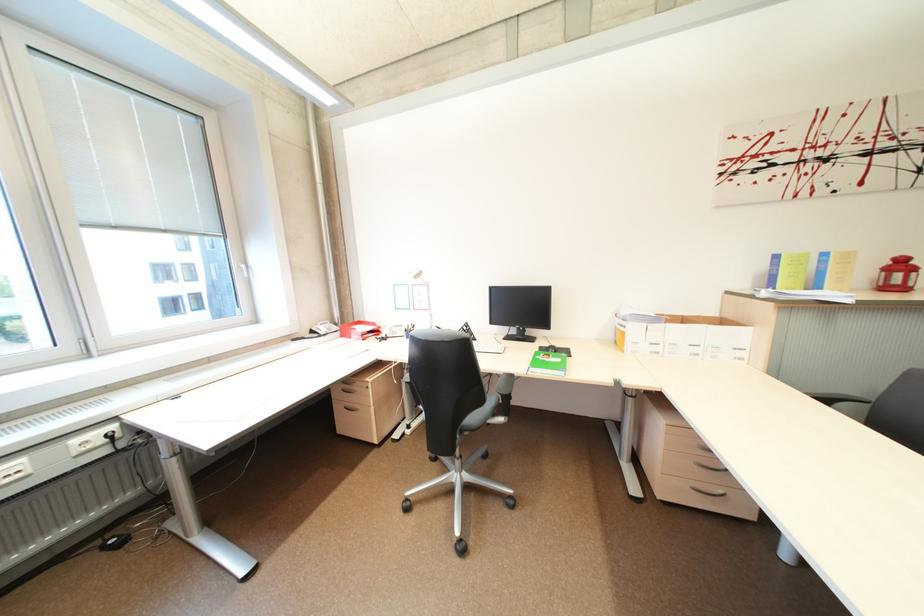
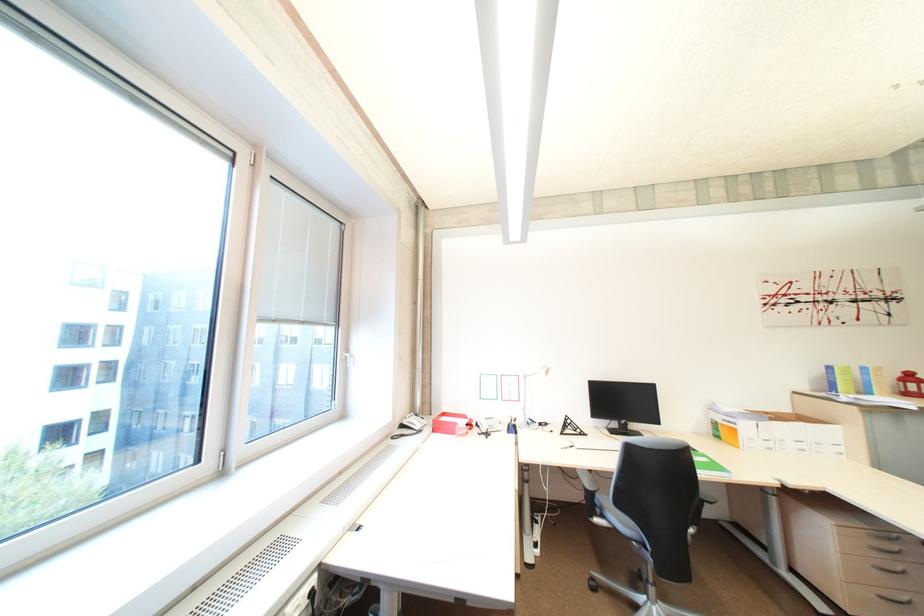
The point at (896, 270) is marked in the first image. Where is the corresponding point in the second image?

(913, 382)